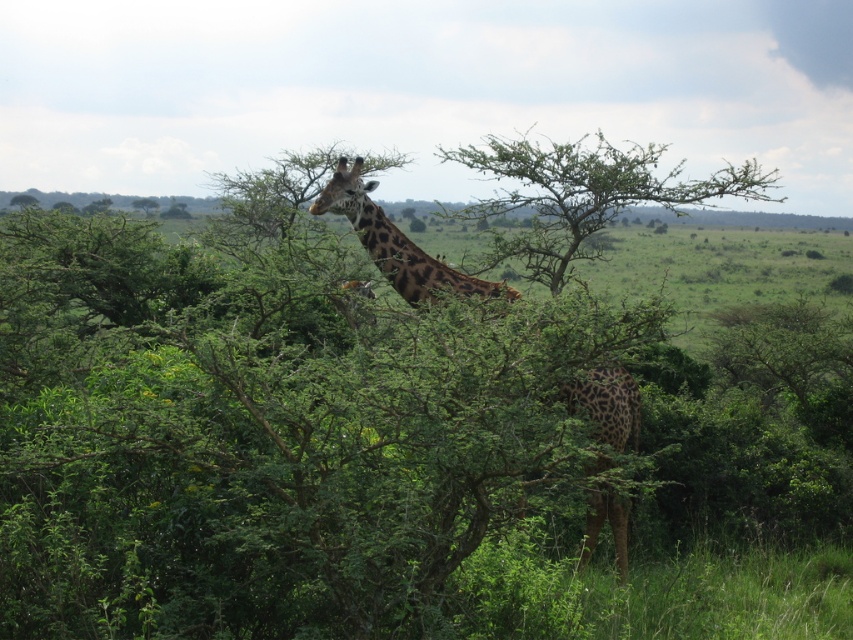
Does green leafy bush at center have a lesser height compared to spotted fur giraffe at center?

Incorrect, green leafy bush at center's height does not fall short of spotted fur giraffe at center's.

Does point (202, 250) lie behind point (349, 218)?

Yes.

In order to click on green leafy bush at center in this screenshot , I will do `click(341, 444)`.

The image size is (853, 640). I want to click on green leafy bush at center, so click(341, 444).

Who is higher up, green leafy tree at center or spotted fur giraffe at center?

Positioned higher is green leafy tree at center.

Does green leafy tree at center appear over spotted fur giraffe at center?

Yes, green leafy tree at center is above spotted fur giraffe at center.

Measure the distance between green leafy tree at center and camera.

green leafy tree at center and camera are 9.16 meters apart.

Identify the location of green leafy tree at center. (582, 195).

Looking at this image, is green leafy bush at center bigger than green leafy tree at center?

No.

Between point (477, 592) and point (489, 256), which one is positioned in front?

Positioned in front is point (477, 592).

You are a GUI agent. You are given a task and a screenshot of the screen. Output one action in this format:
    pyautogui.click(x=<x>, y=<y>)
    Task: Click on the green leafy bush at center
    The image size is (853, 640).
    Given the screenshot: What is the action you would take?
    pyautogui.click(x=341, y=444)